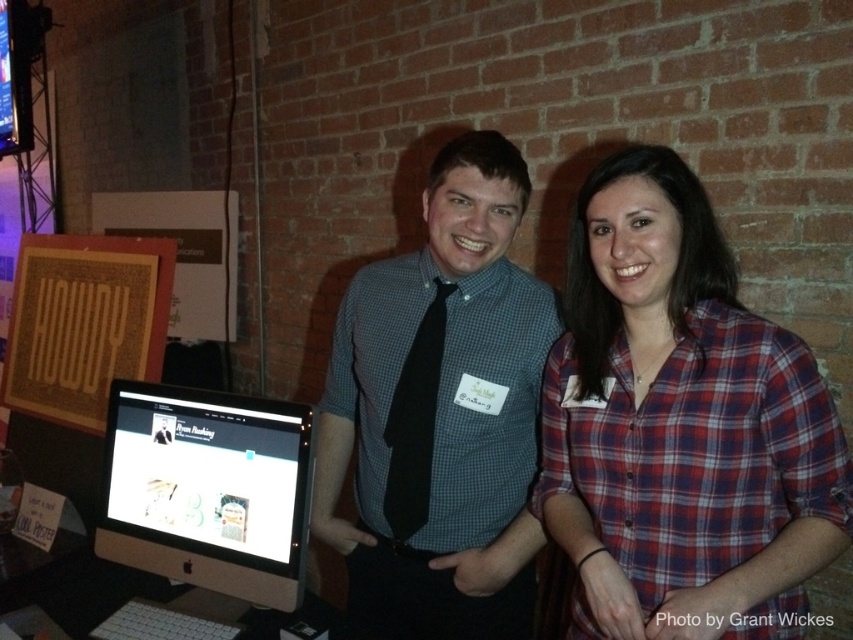
Question: Which point is closer to the camera?

Choices:
 (A) (427, 259)
 (B) (624, 333)
 (C) (169, 570)

Answer: (B)

Question: Can you confirm if plaid cotton shirt at center is bigger than satin black monitor at center?

Choices:
 (A) yes
 (B) no

Answer: (A)

Question: Which object appears farthest from the camera in this image?

Choices:
 (A) checkered fabric shirt at center
 (B) satin black monitor at center
 (C) plaid cotton shirt at center

Answer: (A)

Question: Can you confirm if plaid cotton shirt at center is positioned to the left of checkered fabric shirt at center?

Choices:
 (A) yes
 (B) no

Answer: (B)

Question: Which point appears farthest from the camera in this image?

Choices:
 (A) (239, 570)
 (B) (550, 342)

Answer: (B)

Question: Is checkered fabric shirt at center closer to camera compared to satin black monitor at center?

Choices:
 (A) yes
 (B) no

Answer: (B)